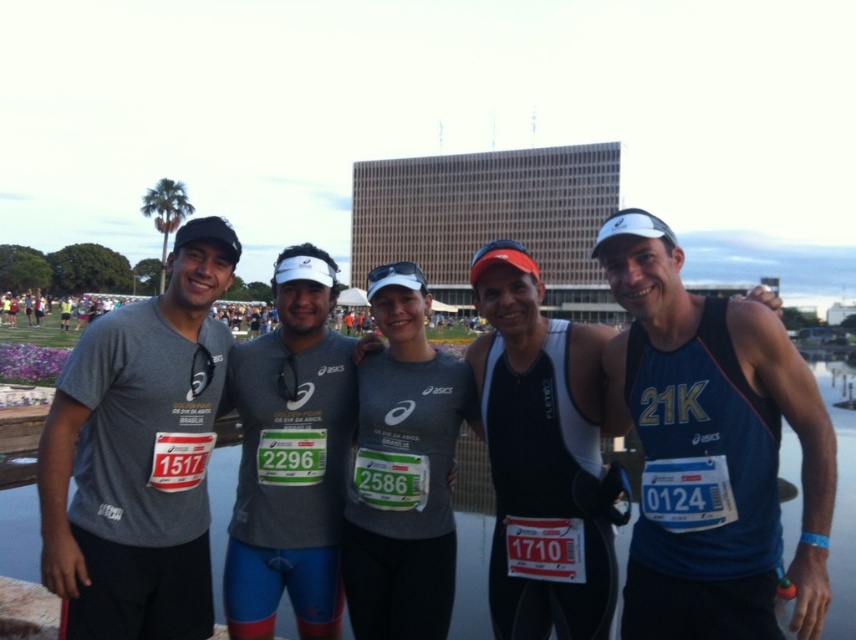
Based on the photo, can you confirm if black matte tank top at center is positioned below matte gray shirt at center?

No.

Looking at this image, who is shorter, black matte tank top at center or matte gray shirt at center?

Standing shorter between the two is matte gray shirt at center.

Between point (611, 609) and point (477, 413), which one is positioned in front?

Point (611, 609) is in front.

Where is `black matte tank top at center`? black matte tank top at center is located at coordinates click(x=541, y=456).

Which is more to the left, matte gray t-shirt at left or matte gray shirt at center?

matte gray t-shirt at left is more to the left.

Looking at this image, can you confirm if matte gray t-shirt at left is wider than matte gray shirt at center?

Indeed, matte gray t-shirt at left has a greater width compared to matte gray shirt at center.

Locate an element on the screen. The width and height of the screenshot is (856, 640). matte gray t-shirt at left is located at coordinates (140, 456).

Who is positioned more to the right, matte gray shirt at center or transparent water at center?

From the viewer's perspective, transparent water at center appears more on the right side.

Is point (385, 332) in front of point (484, 541)?

Yes, it is.

Find the location of a particular element. The height and width of the screenshot is (640, 856). matte gray shirt at center is located at coordinates (403, 467).